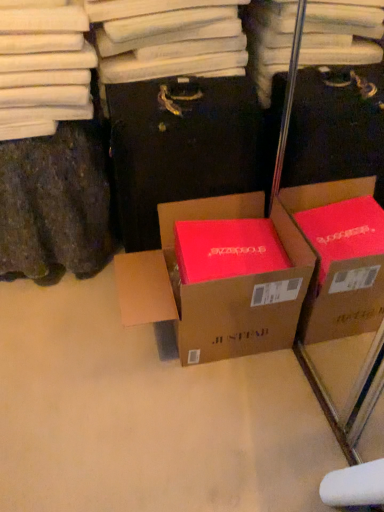
Question: From a real-world perspective, is matte cardboard box at center physically located above or below matte brown cardboard box at center?

Choices:
 (A) above
 (B) below

Answer: (B)

Question: From their relative heights in the image, would you say matte cardboard box at center is taller or shorter than matte brown cardboard box at center?

Choices:
 (A) short
 (B) tall

Answer: (A)

Question: Considering the positions of matte cardboard box at center and matte brown cardboard box at center in the image, is matte cardboard box at center wider or thinner than matte brown cardboard box at center?

Choices:
 (A) thin
 (B) wide

Answer: (B)

Question: Does point (150, 110) appear closer or farther from the camera than point (231, 227)?

Choices:
 (A) farther
 (B) closer

Answer: (B)

Question: Do you think matte brown cardboard box at center is within matte cardboard box at center, or outside of it?

Choices:
 (A) inside
 (B) outside

Answer: (B)

Question: From the image's perspective, is matte brown cardboard box at center positioned above or below matte cardboard box at center?

Choices:
 (A) below
 (B) above

Answer: (B)

Question: From a real-world perspective, is matte brown cardboard box at center above or below matte cardboard box at center?

Choices:
 (A) above
 (B) below

Answer: (A)